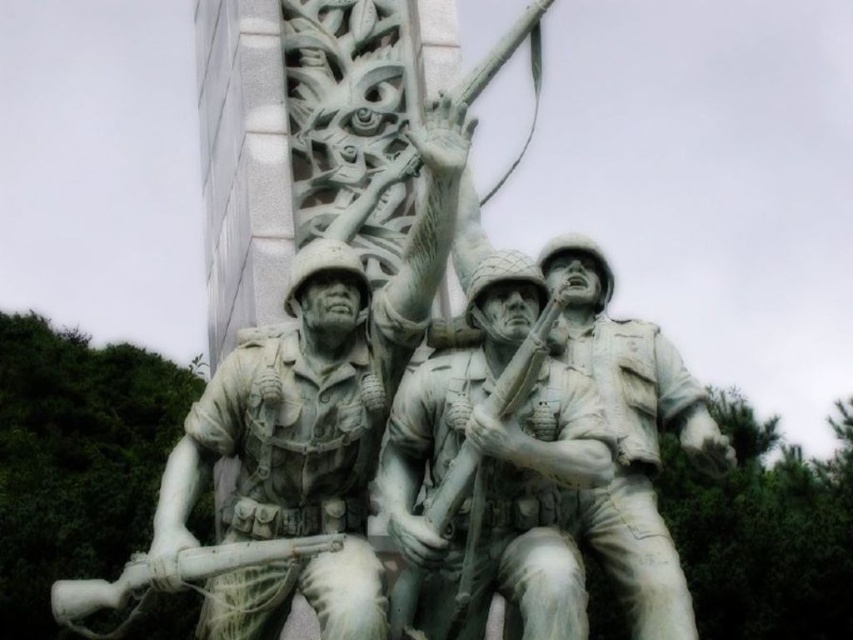
Is white marble statue at center below gray stone soldier at center?

No.

Which is in front, point (270, 449) or point (381, 496)?

Point (270, 449) is more forward.

Is point (355, 292) in front of point (490, 417)?

No, it is not.

Identify the location of white marble statue at center. This screenshot has height=640, width=853. (312, 419).

Between gray stone soldier at center and white stone soldier at center, which one has more height?

With more height is white stone soldier at center.

Does gray stone soldier at center appear on the left side of white stone soldier at center?

Correct, you'll find gray stone soldier at center to the left of white stone soldier at center.

Image resolution: width=853 pixels, height=640 pixels. I want to click on gray stone soldier at center, so click(494, 461).

Which is more to the right, white marble statue at center or white stone soldier at center?

Positioned to the right is white stone soldier at center.

Is white marble statue at center thinner than white stone soldier at center?

Incorrect, white marble statue at center's width is not less than white stone soldier at center's.

This screenshot has width=853, height=640. Identify the location of white marble statue at center. (312, 419).